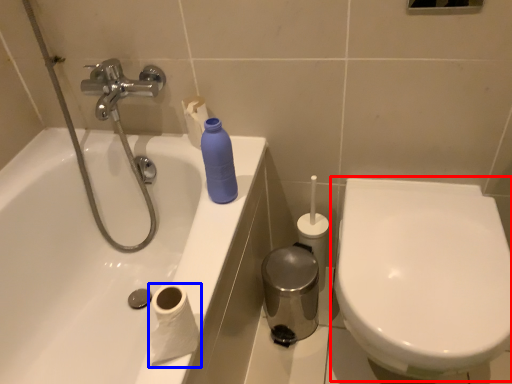
Question: Among these objects, which one is farthest to the camera, toilet (highlighted by a red box) or toilet paper (highlighted by a blue box)?

Choices:
 (A) toilet
 (B) toilet paper

Answer: (A)